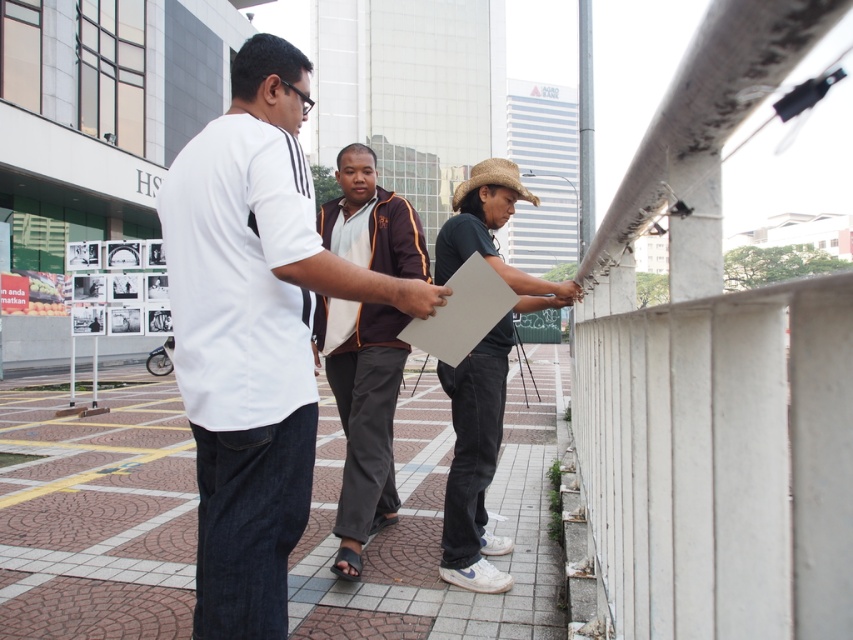
Question: Is brown fabric jacket at center further to the viewer compared to dark green matte shirt at center?

Choices:
 (A) no
 (B) yes

Answer: (A)

Question: Which point is farther to the camera?

Choices:
 (A) brick paved at center
 (B) white matte shirt at center

Answer: (A)

Question: Can you confirm if brick paved at center is smaller than brown fabric jacket at center?

Choices:
 (A) yes
 (B) no

Answer: (B)

Question: Can you confirm if brick paved at center is bigger than brown fabric jacket at center?

Choices:
 (A) yes
 (B) no

Answer: (A)

Question: Which point appears farthest from the camera in this image?

Choices:
 (A) (456, 396)
 (B) (277, 513)
 (C) (360, 182)

Answer: (C)

Question: Which is nearer to the white matte shirt at center?

Choices:
 (A) dark green matte shirt at center
 (B) brick paved at center
 (C) brown fabric jacket at center

Answer: (C)